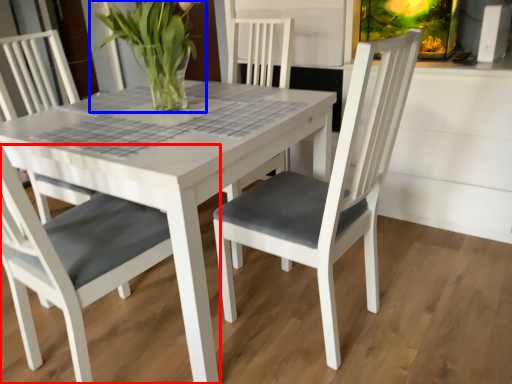
Question: Which object appears closest to the camera in this image, chair (highlighted by a red box) or houseplant (highlighted by a blue box)?

Choices:
 (A) chair
 (B) houseplant

Answer: (A)